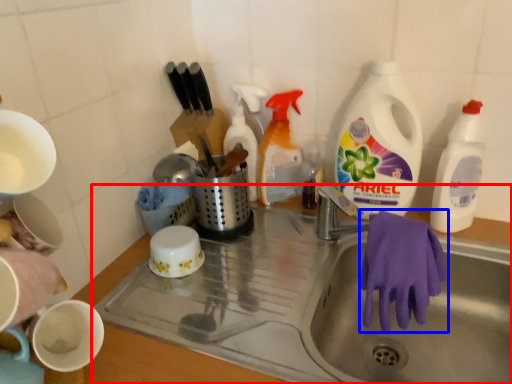
Question: Which point is further to the camera, sink (highlighted by a red box) or glove (highlighted by a blue box)?

Choices:
 (A) sink
 (B) glove

Answer: (B)